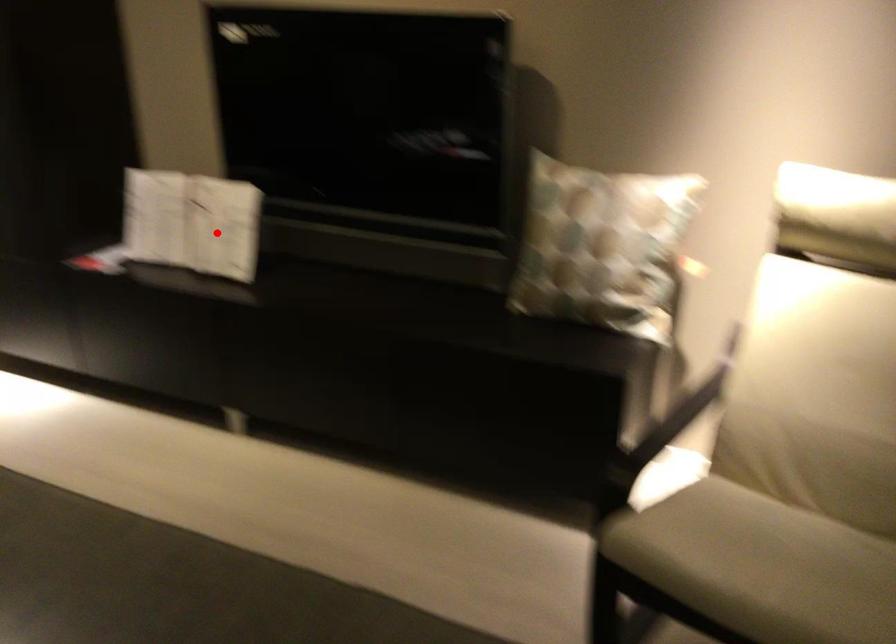
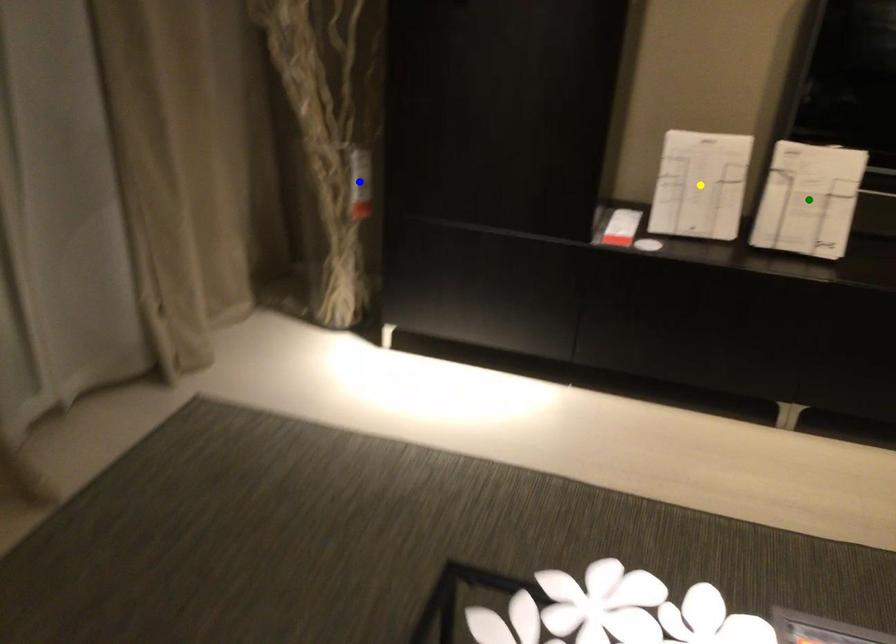
Question: I am providing you with two images of the same scene from different viewpoints. A red point is marked on the first image. You are given multiple points on the second image. Which point in image 2 represents the same 3d spot as the red point in image 1?

Choices:
 (A) blue point
 (B) green point
 (C) yellow point

Answer: (B)